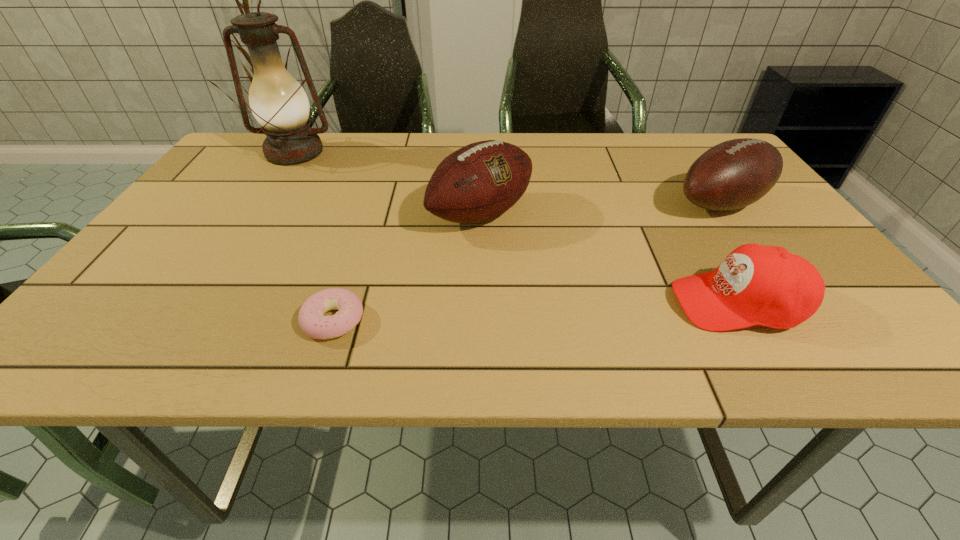
At what (x,y) coordinates should I click in order to perform the action: click on free space between the right football (American) and the fourth object from right to left. Please return your answer as a coordinate pair (x, y). Looking at the image, I should click on (527, 262).

This screenshot has height=540, width=960. Identify the location of free space between the doughnut and the baseball cap. (536, 312).

The image size is (960, 540). Find the location of `free spot between the third object from left to right and the leftmost object`. free spot between the third object from left to right and the leftmost object is located at coordinates (388, 183).

Identify the location of free point between the shortest object and the third object from left to right. The width and height of the screenshot is (960, 540). (407, 267).

Where is `empty space between the right football (American) and the fourth tallest object`? The image size is (960, 540). empty space between the right football (American) and the fourth tallest object is located at coordinates (730, 253).

Select which object appears as the third closest to the shortest object. Please provide its 2D coordinates. Your answer should be formatted as a tuple, i.e. [(x, y)], where the tuple contains the x and y coordinates of a point satisfying the conditions above.

[(762, 285)]

Identify which object is located as the nearest to the second shortest object. Please provide its 2D coordinates. Your answer should be formatted as a tuple, i.e. [(x, y)], where the tuple contains the x and y coordinates of a point satisfying the conditions above.

[(736, 173)]

The width and height of the screenshot is (960, 540). I want to click on blank space that satisfies the following two spatial constraints: 1. on the front side of the shortest object; 2. on the left side of the leftmost object, so click(186, 320).

I want to click on free space that satisfies the following two spatial constraints: 1. on the front side of the right football (American); 2. on the front panel of the baseball cap, so click(792, 303).

Where is `vacant space that satisfies the following two spatial constraints: 1. on the front side of the right football (American); 2. on the front panel of the fourth tallest object`? The width and height of the screenshot is (960, 540). vacant space that satisfies the following two spatial constraints: 1. on the front side of the right football (American); 2. on the front panel of the fourth tallest object is located at coordinates (792, 303).